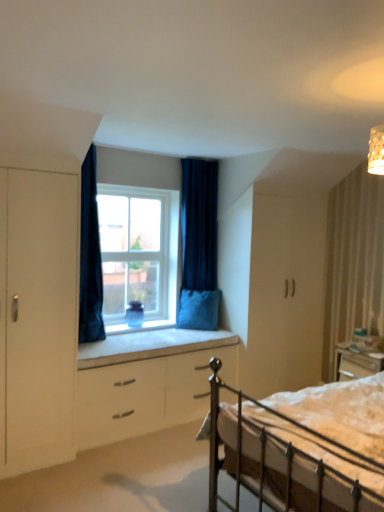
The height and width of the screenshot is (512, 384). Find the location of `free region under white matte cabinet at left (from a real-world perspective)`. free region under white matte cabinet at left (from a real-world perspective) is located at coordinates (x=40, y=466).